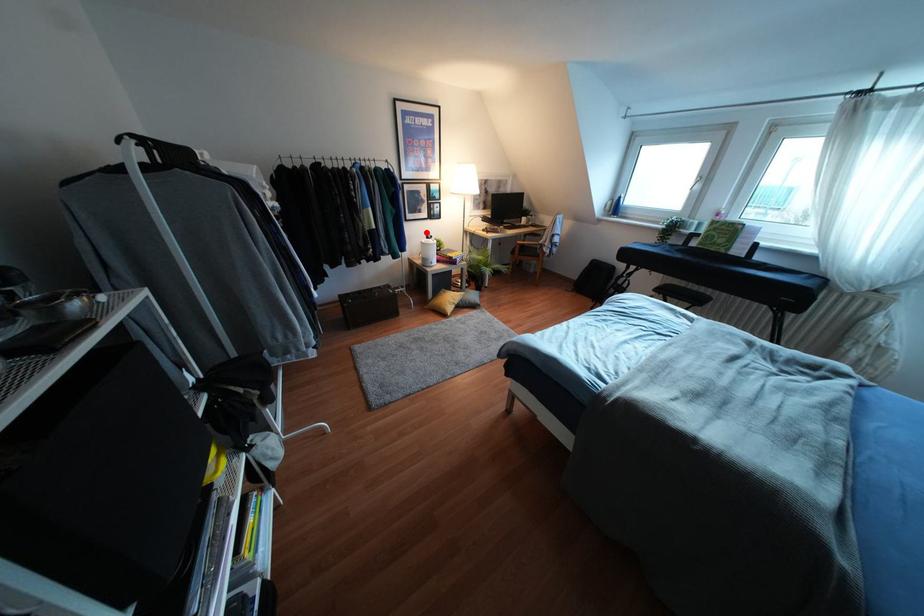
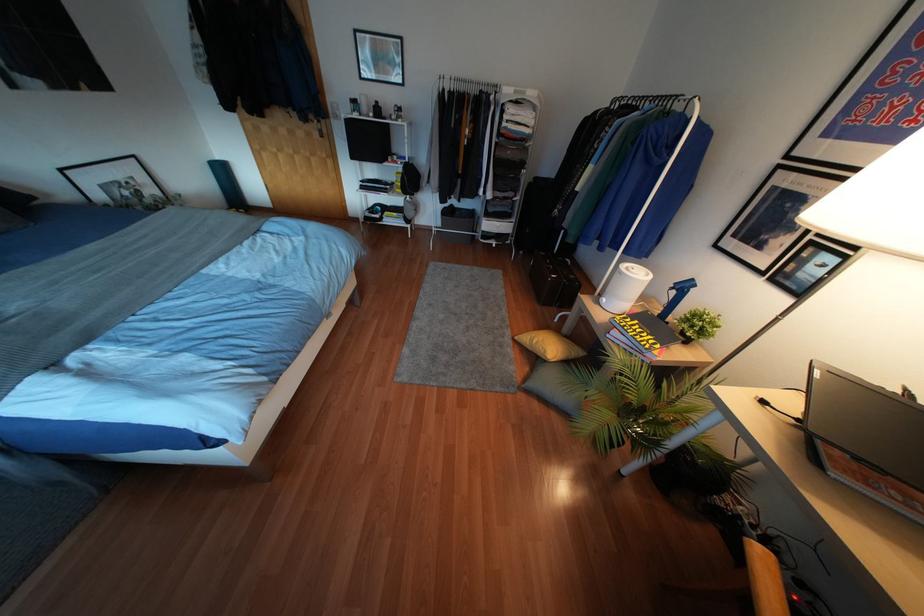
In the second image, find the point that corresponds to the highlighted location in the first image.

(690, 280)